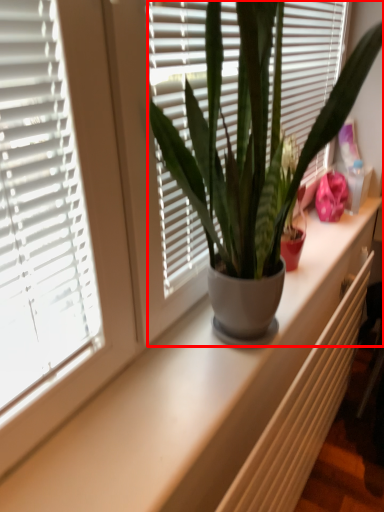
Question: From the image's perspective, considering the relative positions of houseplant (annotated by the red box) and radiator in the image provided, where is houseplant (annotated by the red box) located with respect to the staircase?

Choices:
 (A) above
 (B) below

Answer: (A)